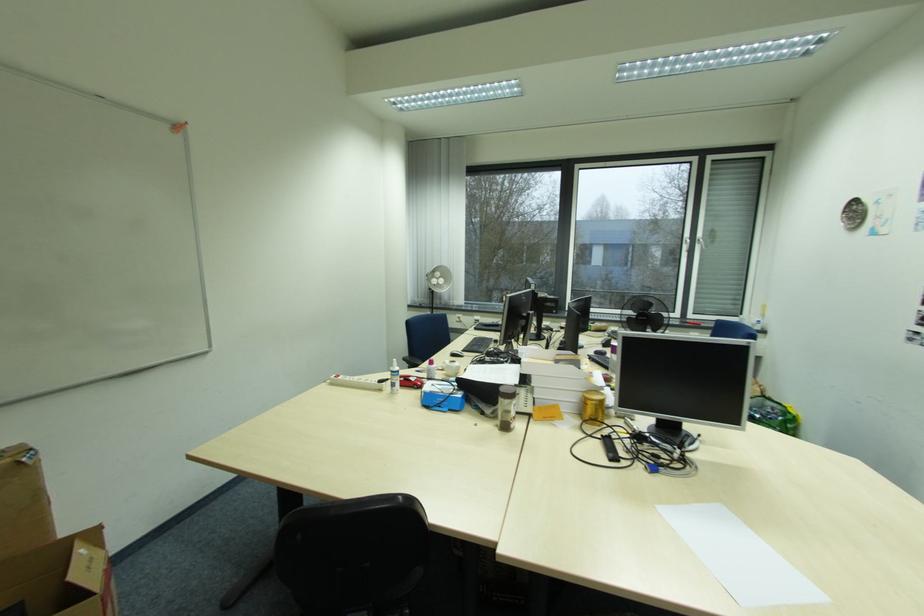
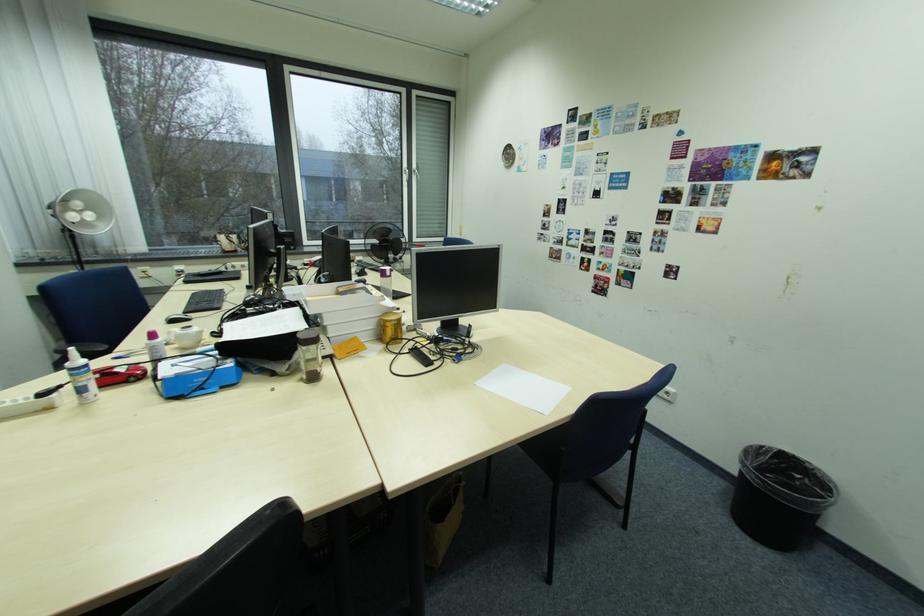
The point at (663, 506) is marked in the first image. Where is the corresponding point in the second image?

(482, 384)